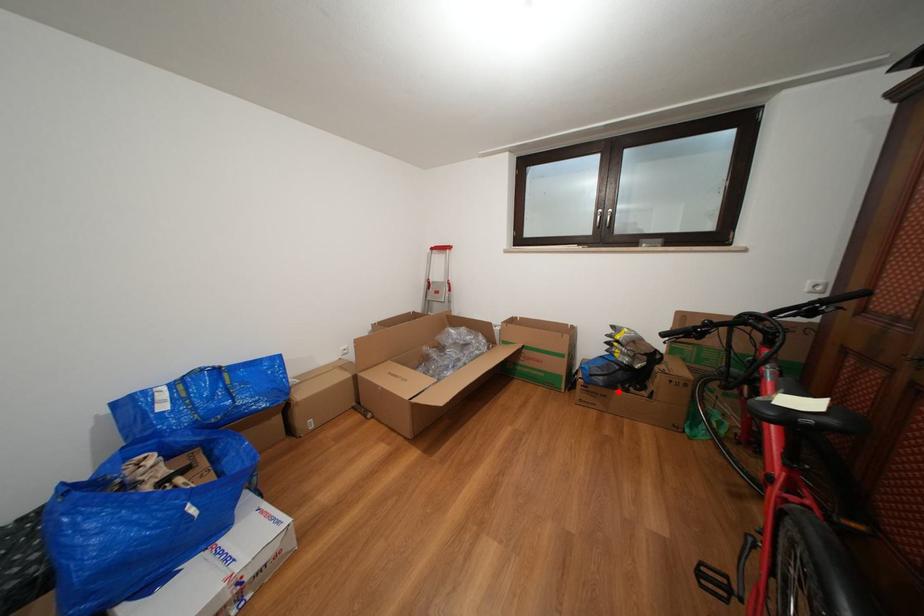
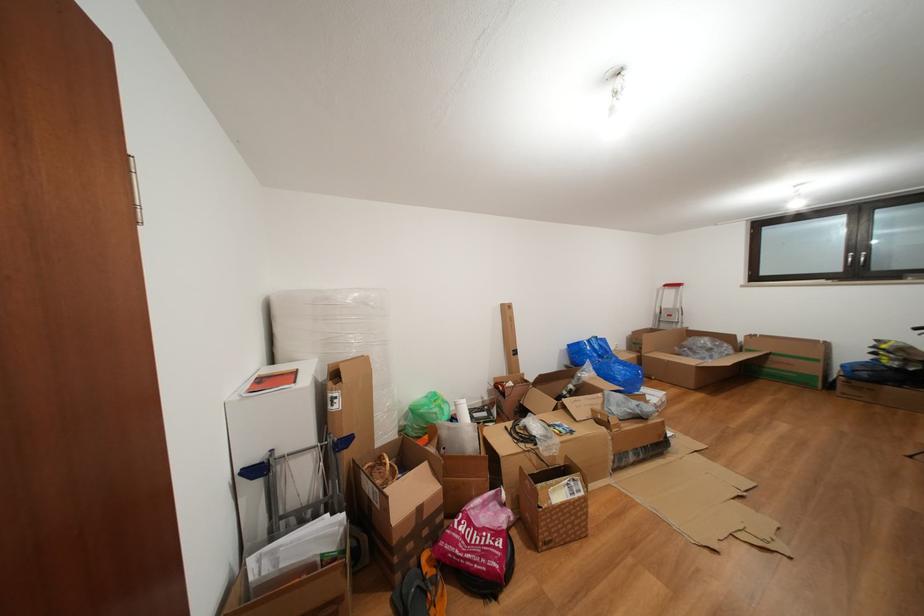
Question: A red point is marked in image1. In image2, is the corresponding 3D point closer to the camera or farther? Reply with the corresponding letter.

Choices:
 (A) The corresponding 3D point is closer.
 (B) The corresponding 3D point is farther.

Answer: (B)